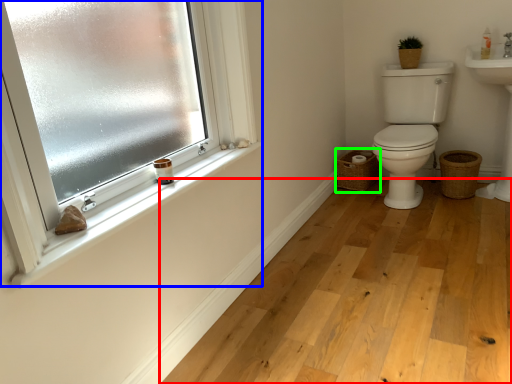
Question: Considering the real-world distances, which object is closest to plain (highlighted by a red box)? window (highlighted by a blue box) or basket (highlighted by a green box).

Choices:
 (A) window
 (B) basket

Answer: (B)